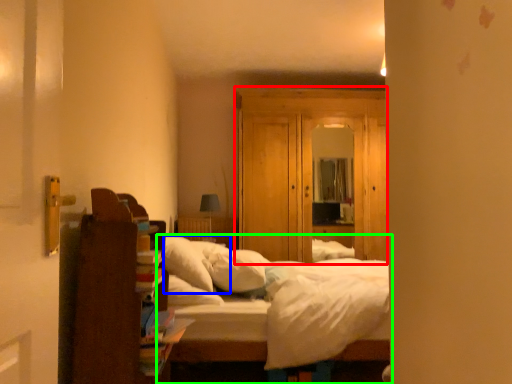
Question: Which object is the closest to the dresser (highlighted by a red box)? Choose among these: pillow (highlighted by a blue box) or bed (highlighted by a green box).

Choices:
 (A) pillow
 (B) bed

Answer: (A)